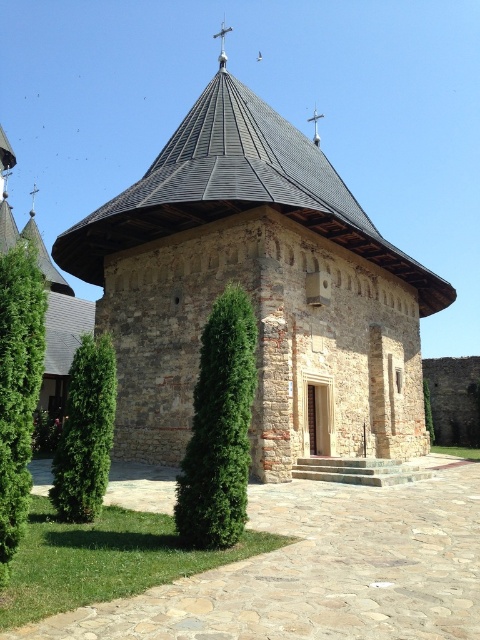
In the scene shown: Does green textured bush at left appear on the right side of brown stone church at lower left?

Indeed, green textured bush at left is positioned on the right side of brown stone church at lower left.

Can you confirm if green textured bush at left is positioned below brown stone church at lower left?

Correct, green textured bush at left is located below brown stone church at lower left.

I want to click on green textured bush at left, so click(17, 388).

Does green textured bush at left have a lesser height compared to green leafy tree at lower left?

No.

Identify the location of green textured bush at left. (17, 388).

Identify the location of green textured bush at left. (17, 388).

Measure the distance from green leafy tree at center to brown stone church at lower left.

green leafy tree at center and brown stone church at lower left are 29.40 meters apart.

Measure the distance from green leafy tree at center to brown stone church at lower left.

The distance of green leafy tree at center from brown stone church at lower left is 29.40 meters.

Is point (211, 381) positioned after point (63, 368)?

No, it is in front of (63, 368).

Image resolution: width=480 pixels, height=640 pixels. What are the coordinates of `green leafy tree at center` in the screenshot? It's located at (219, 428).